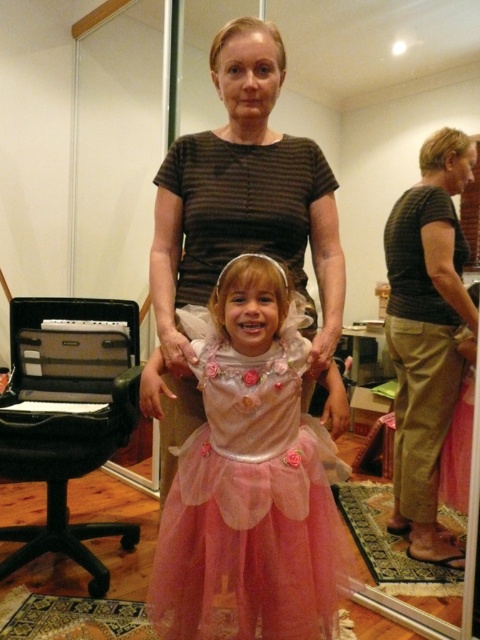
Is pink tulle dress at center smaller than matte brown shirt at upper right?

Indeed, pink tulle dress at center has a smaller size compared to matte brown shirt at upper right.

Does pink tulle dress at center appear under matte brown shirt at upper right?

Indeed, pink tulle dress at center is positioned under matte brown shirt at upper right.

What do you see at coordinates (251, 481) in the screenshot?
I see `pink tulle dress at center` at bounding box center [251, 481].

This screenshot has width=480, height=640. Find the location of `pink tulle dress at center`. pink tulle dress at center is located at coordinates (251, 481).